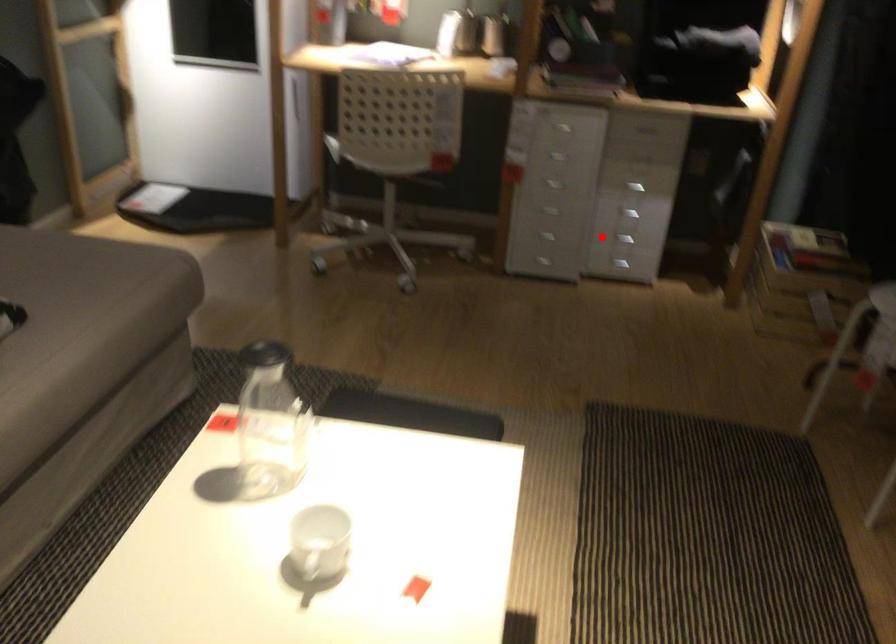
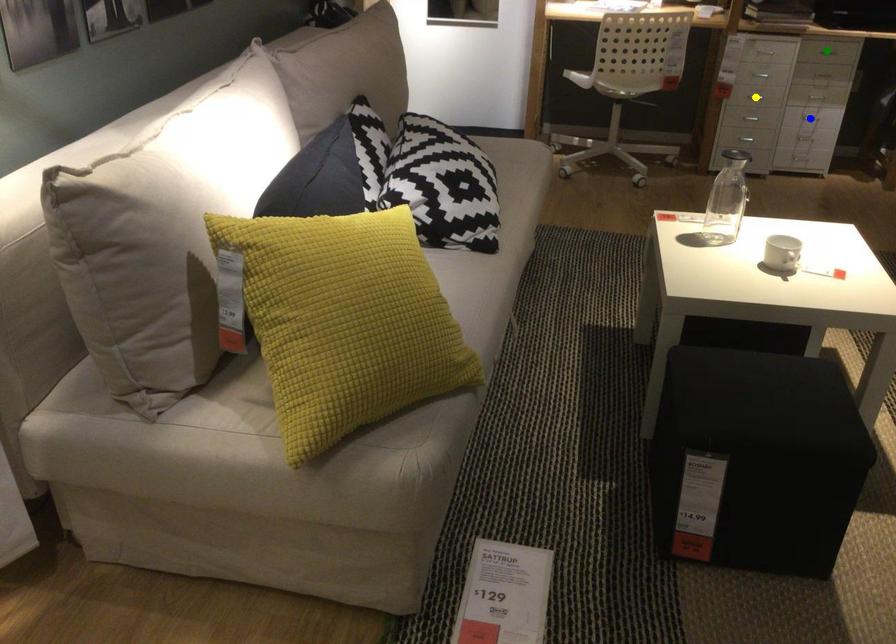
Question: I am providing you with two images of the same scene from different viewpoints. A red point is marked on the first image. You are given multiple points on the second image. In image 2, which mark is for the same physical point as the one in image 1?

Choices:
 (A) green point
 (B) blue point
 (C) yellow point

Answer: (B)